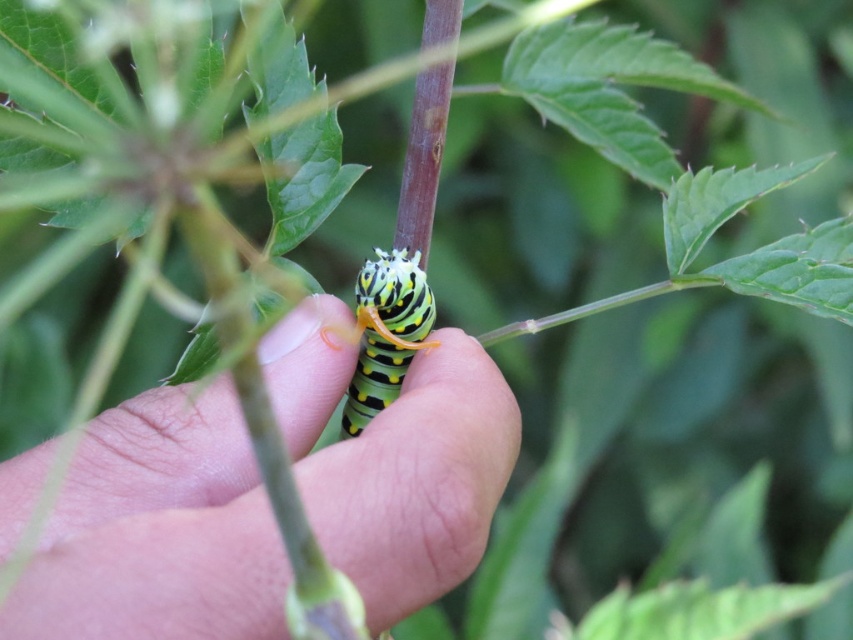
Question: Where is green matte caterpillar at center located in relation to yellow-green striped caterpillar at center in the image?

Choices:
 (A) above
 (B) below

Answer: (B)

Question: Which point is closer to the camera taking this photo?

Choices:
 (A) (410, 260)
 (B) (299, 408)

Answer: (B)

Question: Is green matte caterpillar at center closer to camera compared to yellow-green striped caterpillar at center?

Choices:
 (A) yes
 (B) no

Answer: (A)

Question: Does green matte caterpillar at center come behind yellow-green striped caterpillar at center?

Choices:
 (A) yes
 (B) no

Answer: (B)